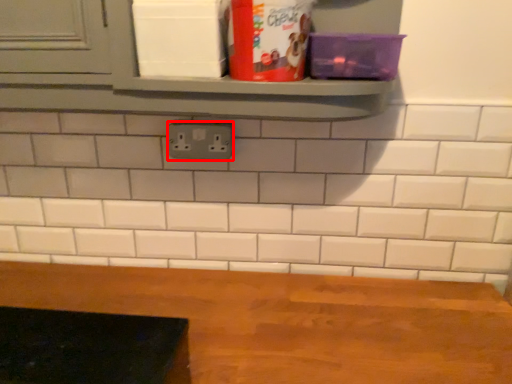
Question: Where is electric outlet (annotated by the red box) located in relation to table in the image?

Choices:
 (A) left
 (B) right

Answer: (A)